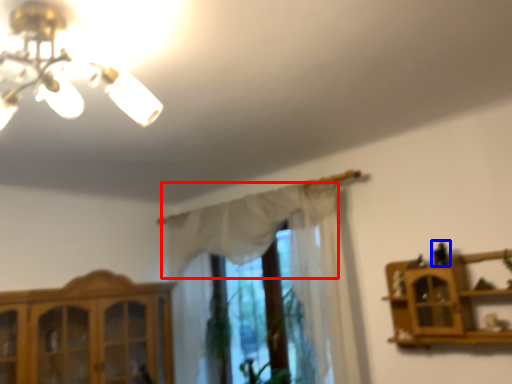
Question: Among these objects, which one is farthest to the camera, curtain (highlighted by a red box) or toy (highlighted by a blue box)?

Choices:
 (A) curtain
 (B) toy

Answer: (A)